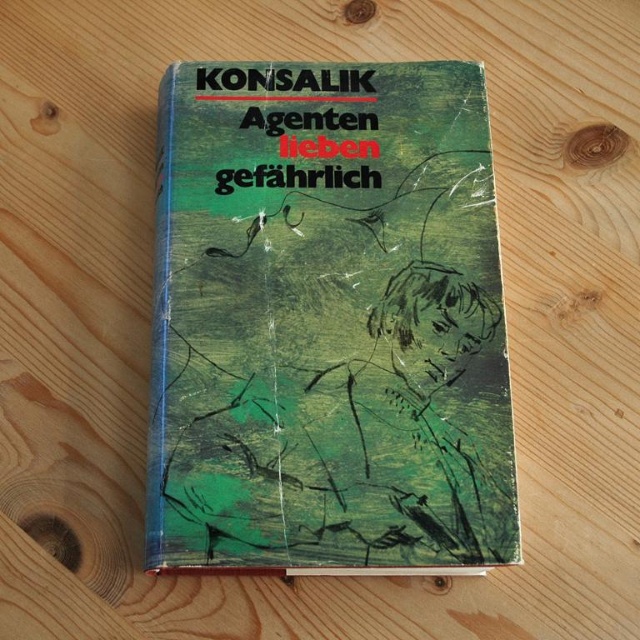
Question: Is green matte book at center to the left of black paper title at upper center from the viewer's perspective?

Choices:
 (A) yes
 (B) no

Answer: (B)

Question: Is green matte book at center further to the viewer compared to black paper title at upper center?

Choices:
 (A) yes
 (B) no

Answer: (B)

Question: Which of the following is the farthest from the observer?

Choices:
 (A) (244, 80)
 (B) (484, 403)

Answer: (A)

Question: Can you confirm if green matte book at center is wider than black paper title at upper center?

Choices:
 (A) no
 (B) yes

Answer: (B)

Question: Which object is closer to the camera taking this photo?

Choices:
 (A) green matte book at center
 (B) black paper title at upper center

Answer: (A)